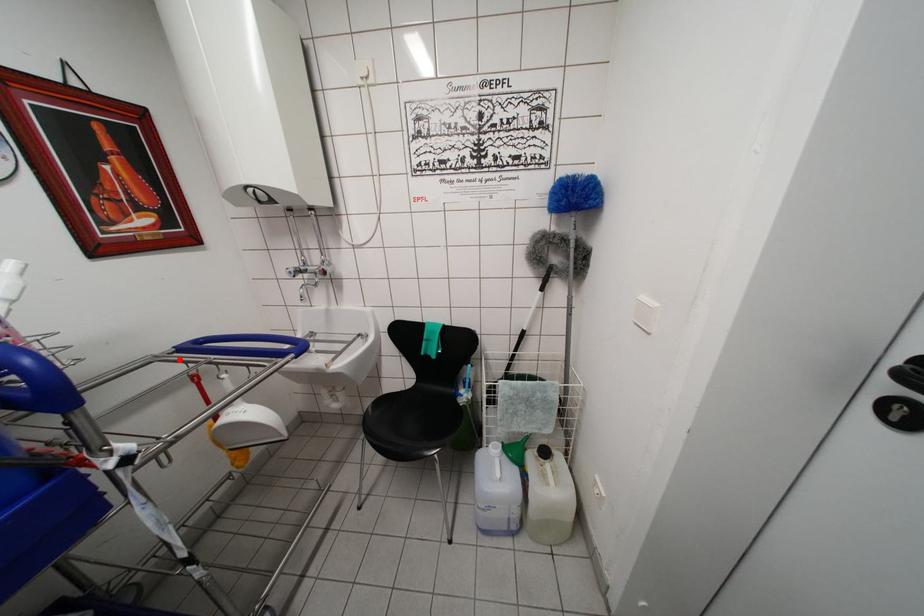
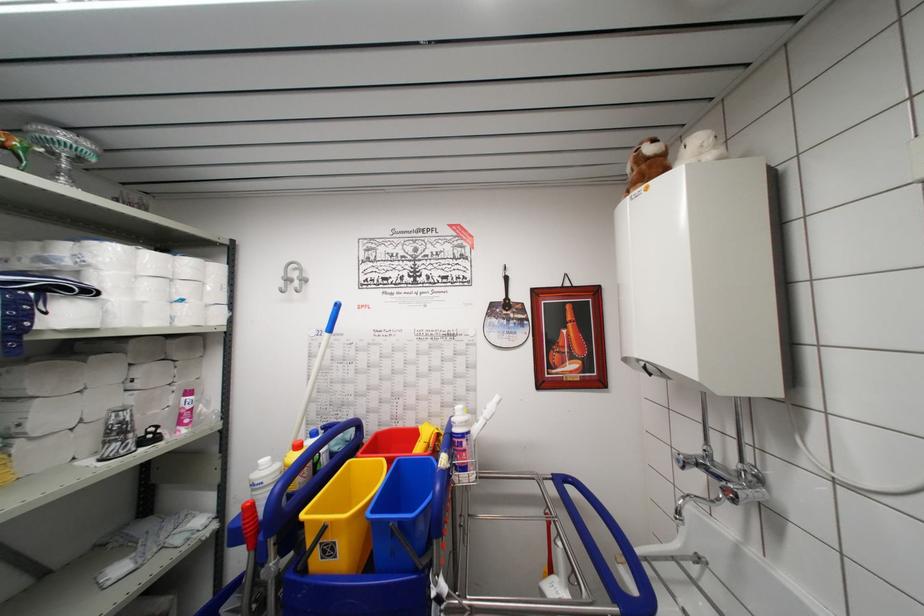
The point at the highlighted location is marked in the first image. Where is the corresponding point in the second image?

(554, 487)